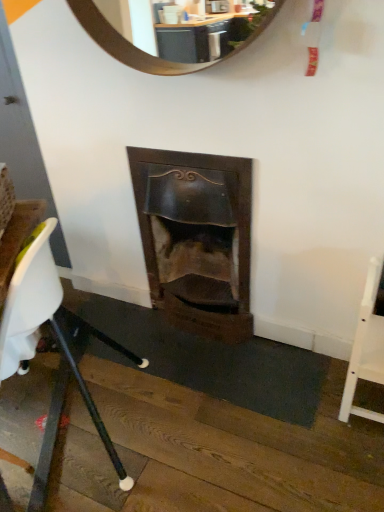
I want to click on free space between white wood chair at right, placed as the 2th chair when sorted from left to right, and wooden fireplace at center, so click(268, 364).